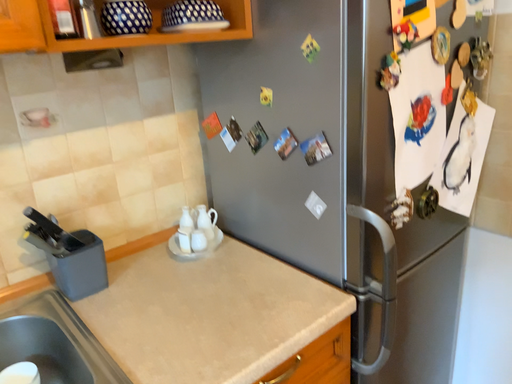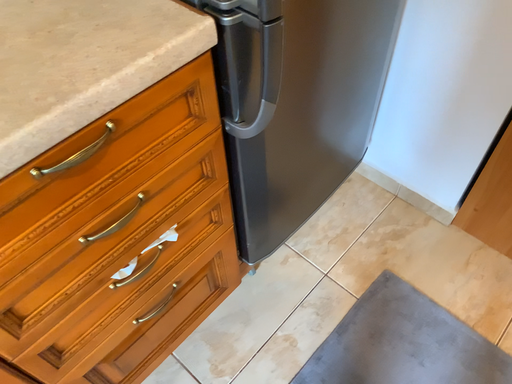
Question: How did the camera likely rotate when shooting the video?

Choices:
 (A) rotated right
 (B) rotated left

Answer: (A)